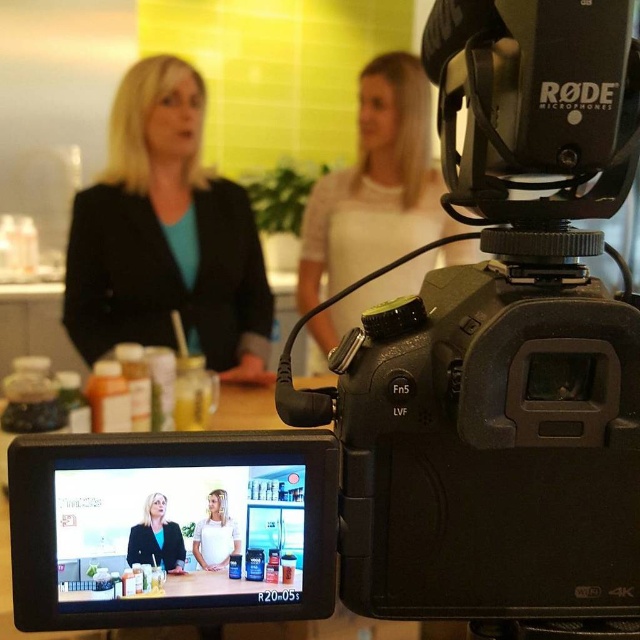
Question: Estimate the real-world distances between objects in this image. Which object is closer to the black matte blazer at left?

Choices:
 (A) matte black blazer at center
 (B) white matte shirt at center

Answer: (A)

Question: Does black matte blazer at left have a smaller size compared to matte black blazer at center?

Choices:
 (A) no
 (B) yes

Answer: (A)

Question: Among these objects, which one is nearest to the camera?

Choices:
 (A) black matte blazer at left
 (B) matte black blazer at center

Answer: (B)

Question: Estimate the real-world distances between objects in this image. Which object is farther from the matte black camera at upper right?

Choices:
 (A) matte black blazer at center
 (B) black matte blazer at left

Answer: (A)

Question: Considering the relative positions of matte black blazer at center and white matte shirt at center in the image provided, where is matte black blazer at center located with respect to white matte shirt at center?

Choices:
 (A) above
 (B) below

Answer: (B)

Question: Is black matte blazer at left in front of matte black camera at upper right?

Choices:
 (A) yes
 (B) no

Answer: (A)